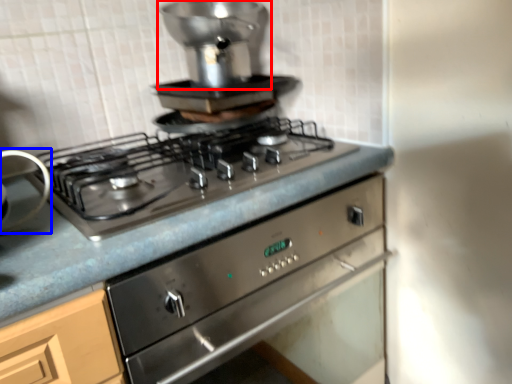
Question: Which of the following is the farthest to the observer, appliance (highlighted by a red box) or appliance (highlighted by a blue box)?

Choices:
 (A) appliance
 (B) appliance

Answer: (A)